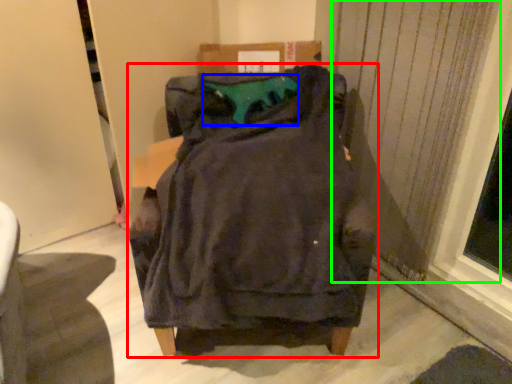
Question: Which object is the farthest from furniture (highlighted by a red box)? Choose among these: teal (highlighted by a blue box) or curtain (highlighted by a green box).

Choices:
 (A) teal
 (B) curtain

Answer: (B)